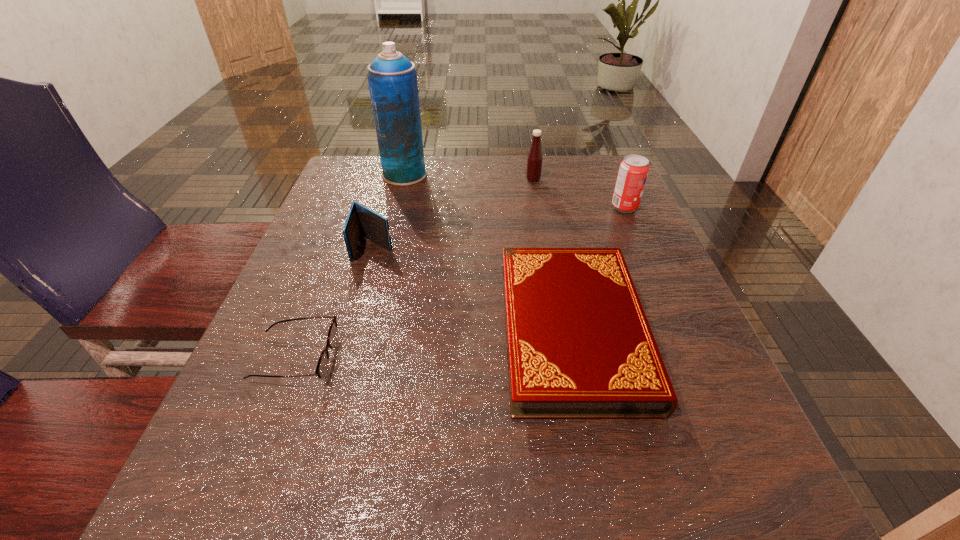
Image resolution: width=960 pixels, height=540 pixels. I want to click on free spot located on the front of the soda can, so click(675, 321).

The height and width of the screenshot is (540, 960). What are the coordinates of `vacant space situated on the exterior surface of the fourth tallest object` in the screenshot? It's located at (353, 320).

Locate an element on the screen. free point located 0.120m on the cover of the hardback book is located at coordinates (610, 505).

Find the location of `free space located on the face of the spectacles`. free space located on the face of the spectacles is located at coordinates (490, 358).

At what (x,y) coordinates should I click in order to perform the action: click on aerosol can present at the far edge. Please return your answer as a coordinate pair (x, y). The width and height of the screenshot is (960, 540). Looking at the image, I should click on (392, 78).

Find the location of a particular element. Tabasco sauce that is at the far edge is located at coordinates (534, 160).

I want to click on soda can at the far edge, so click(633, 171).

Identify the location of aerosol can at the left edge. (392, 78).

Where is `wallet that is at the left edge`? wallet that is at the left edge is located at coordinates (360, 220).

Find the location of a particular element. This screenshot has width=960, height=540. spectacles located in the left edge section of the desktop is located at coordinates (321, 371).